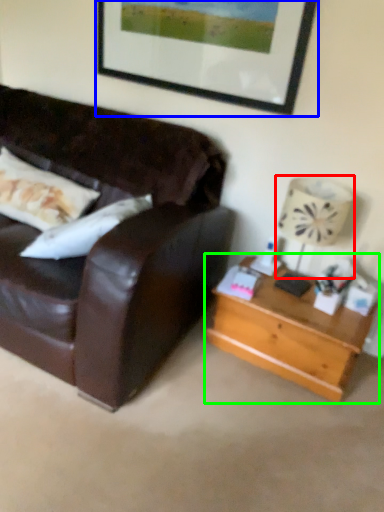
Question: Estimate the real-world distances between objects in this image. Which object is closer to lamp (highlighted by a red box), picture frame (highlighted by a blue box) or table (highlighted by a green box)?

Choices:
 (A) picture frame
 (B) table

Answer: (B)